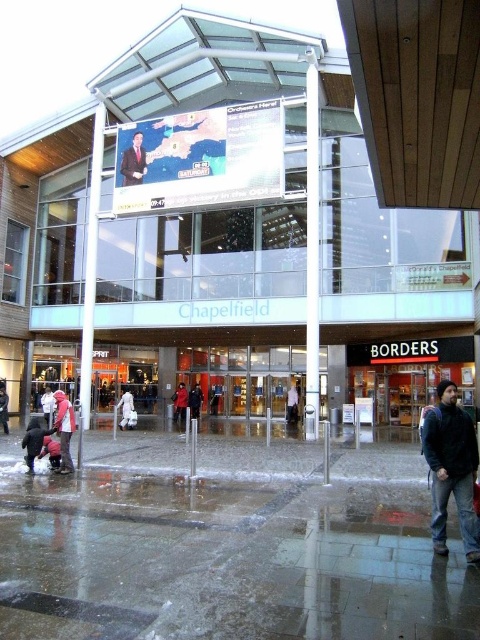
Question: Which point is farther to the camera?

Choices:
 (A) (34, 460)
 (B) (66, 412)

Answer: (B)

Question: Is glass storefront at center positioned before glass pane at center?

Choices:
 (A) yes
 (B) no

Answer: (A)

Question: Can you confirm if light blue shirt at center is thinner than dark brown leather jacket at lower left?

Choices:
 (A) no
 (B) yes

Answer: (B)

Question: Can you confirm if red wool coat at center is positioned to the right of dark blue jacket at center?

Choices:
 (A) yes
 (B) no

Answer: (B)

Question: Estimate the real-world distances between objects in this image. Which object is farther from the light blue shirt at center?

Choices:
 (A) glass pane at center
 (B) red hooded jacket at lower left

Answer: (B)

Question: Among these points, which one is nearest to the camera?

Choices:
 (A) (197, 385)
 (B) (319, 145)
 (C) (6, 419)

Answer: (C)